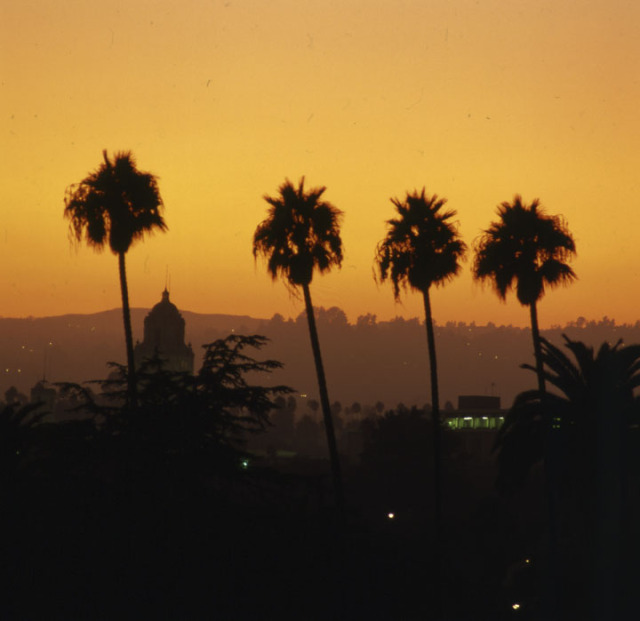
At what (x,y) coordinates should I click in order to perform the action: click on corners. Please return your answer as a coordinate pair (x, y). This screenshot has height=621, width=640. Looking at the image, I should click on pyautogui.click(x=617, y=605), pyautogui.click(x=18, y=603), pyautogui.click(x=11, y=16), pyautogui.click(x=630, y=5).